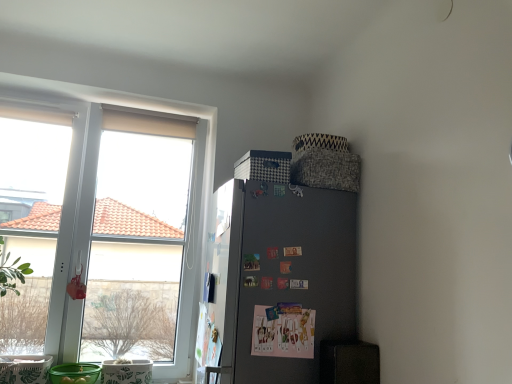
Describe the element at coordinates (194, 201) in the screenshot. I see `white matte window at upper left` at that location.

Where is `white matte window at upper left`? The width and height of the screenshot is (512, 384). white matte window at upper left is located at coordinates (194, 201).

At what (x,y) coordinates should I click in order to perform the action: click on satin black fridge at right. Please return your answer as a coordinate pair (x, y). Image resolution: width=512 pixels, height=384 pixels. Looking at the image, I should click on (280, 281).

Describe the element at coordinates (280, 281) in the screenshot. I see `satin black fridge at right` at that location.

Locate an element on the screen. The image size is (512, 384). white matte window at upper left is located at coordinates (194, 201).

Between satin black fridge at right and white matte window at upper left, which one appears on the left side from the viewer's perspective?

white matte window at upper left is more to the left.

Between satin black fridge at right and white matte window at upper left, which one is positioned behind?

white matte window at upper left.

Considering the points (273, 379) and (157, 109), which point is in front, point (273, 379) or point (157, 109)?

The point (273, 379) is in front.

From the image's perspective, is satin black fridge at right located above or below white matte window at upper left?

From the image's perspective, satin black fridge at right appears below white matte window at upper left.

From a real-world perspective, is satin black fridge at right on top of white matte window at upper left?

No, from a real-world perspective, satin black fridge at right is not above white matte window at upper left.

Is satin black fridge at right wider or thinner than white matte window at upper left?

satin black fridge at right is wider than white matte window at upper left.

Considering the relative sizes of satin black fridge at right and white matte window at upper left in the image provided, is satin black fridge at right shorter than white matte window at upper left?

Correct, satin black fridge at right is not as tall as white matte window at upper left.

From the picture: Considering the sizes of objects satin black fridge at right and white matte window at upper left in the image provided, who is bigger, satin black fridge at right or white matte window at upper left?

white matte window at upper left is bigger.

Is satin black fridge at right inside the boundaries of white matte window at upper left, or outside?

satin black fridge at right exists outside the volume of white matte window at upper left.

Are satin black fridge at right and white matte window at upper left beside each other?

No, satin black fridge at right is not in contact with white matte window at upper left.

Consider the image. Is satin black fridge at right facing towards white matte window at upper left?

No, satin black fridge at right does not turn towards white matte window at upper left.

How different are the orientations of satin black fridge at right and white matte window at upper left in degrees?

The facing directions of satin black fridge at right and white matte window at upper left are 91.3 degrees apart.

You are a GUI agent. You are given a task and a screenshot of the screen. Output one action in this format:
    pyautogui.click(x=<x>, y=<y>)
    Task: Click on the window above the satin black fridge at right (from a real-world perspective)
    The height and width of the screenshot is (384, 512).
    Given the screenshot: What is the action you would take?
    pyautogui.click(x=194, y=201)

Can you confirm if white matte window at upper left is positioned to the left of satin black fridge at right?

Yes.

Looking at this image, between white matte window at upper left and satin black fridge at right, which one is positioned in front?

satin black fridge at right is more forward.

Is point (27, 81) closer or farther from the camera than point (290, 265)?

Point (27, 81) is positioned farther from the camera compared to point (290, 265).

From the image's perspective, which is above, white matte window at upper left or satin black fridge at right?

white matte window at upper left, from the image's perspective.

From a real-world perspective, is white matte window at upper left physically located above or below satin black fridge at right?

From a real-world perspective, white matte window at upper left is physically above satin black fridge at right.

Between white matte window at upper left and satin black fridge at right, which one has smaller width?

white matte window at upper left.

Can you confirm if white matte window at upper left is taller than satin black fridge at right?

Yes.

Who is smaller, white matte window at upper left or satin black fridge at right?

satin black fridge at right.

Is white matte window at upper left inside or outside of satin black fridge at right?

white matte window at upper left is spatially situated outside satin black fridge at right.

Is white matte window at upper left far from satin black fridge at right?

Actually, white matte window at upper left and satin black fridge at right are a little close together.

From the picture: Does white matte window at upper left turn towards satin black fridge at right?

No, white matte window at upper left is not facing towards satin black fridge at right.

Measure the distance from white matte window at upper left to satin black fridge at right.

33.30 inches.

This screenshot has width=512, height=384. Find the location of `window above the satin black fridge at right (from the image's perspective)`. window above the satin black fridge at right (from the image's perspective) is located at coordinates (194, 201).

Where is `window that is above the satin black fridge at right (from the image's perspective)`? The height and width of the screenshot is (384, 512). window that is above the satin black fridge at right (from the image's perspective) is located at coordinates (194, 201).

The width and height of the screenshot is (512, 384). Find the location of `refrigerator in front of the white matte window at upper left`. refrigerator in front of the white matte window at upper left is located at coordinates (280, 281).